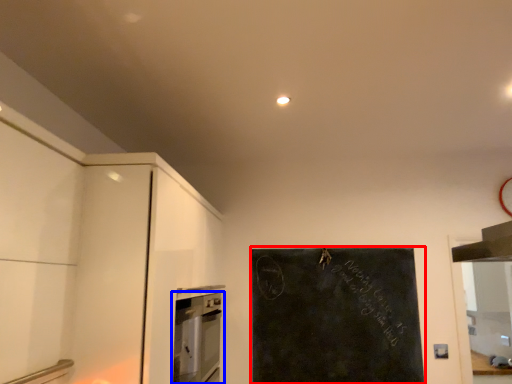
Question: Which object is closer to the camera taking this photo, bulletin board (highlighted by a red box) or home appliance (highlighted by a blue box)?

Choices:
 (A) bulletin board
 (B) home appliance

Answer: (B)